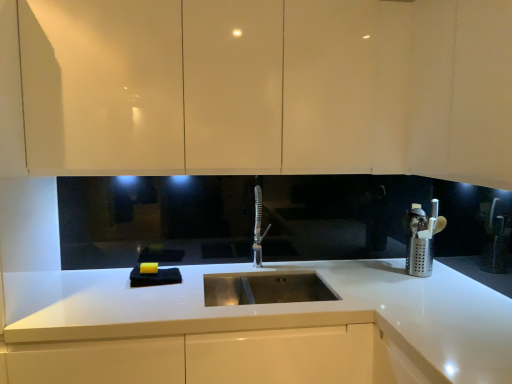
Question: Is satin nickel faucet at center shorter than matte white cabinets at upper center?

Choices:
 (A) no
 (B) yes

Answer: (B)

Question: Is matte white cabinets at upper center completely or partially inside satin nickel faucet at center?

Choices:
 (A) no
 (B) yes

Answer: (A)

Question: Is the depth of satin nickel faucet at center greater than that of matte white cabinets at upper center?

Choices:
 (A) no
 (B) yes

Answer: (B)

Question: Is satin nickel faucet at center bigger than matte white cabinets at upper center?

Choices:
 (A) no
 (B) yes

Answer: (A)

Question: Is satin nickel faucet at center not within matte white cabinets at upper center?

Choices:
 (A) yes
 (B) no

Answer: (A)

Question: Considering the relative positions of satin nickel faucet at center and matte white cabinets at upper center in the image provided, is satin nickel faucet at center to the left of matte white cabinets at upper center from the viewer's perspective?

Choices:
 (A) yes
 (B) no

Answer: (B)

Question: Does matte white cabinets at upper center touch white glossy countertop at center?

Choices:
 (A) no
 (B) yes

Answer: (A)

Question: From a real-world perspective, is matte white cabinets at upper center below white glossy countertop at center?

Choices:
 (A) no
 (B) yes

Answer: (A)

Question: Considering the relative positions of matte white cabinets at upper center and white glossy countertop at center in the image provided, is matte white cabinets at upper center to the right of white glossy countertop at center from the viewer's perspective?

Choices:
 (A) yes
 (B) no

Answer: (B)

Question: From the image's perspective, is matte white cabinets at upper center located beneath white glossy countertop at center?

Choices:
 (A) yes
 (B) no

Answer: (B)

Question: Is matte white cabinets at upper center at the left side of white glossy countertop at center?

Choices:
 (A) yes
 (B) no

Answer: (A)

Question: From the image's perspective, does matte white cabinets at upper center appear higher than white glossy countertop at center?

Choices:
 (A) no
 (B) yes

Answer: (B)

Question: Is silver perforated utensil holder at right aimed at satin nickel faucet at center?

Choices:
 (A) no
 (B) yes

Answer: (B)